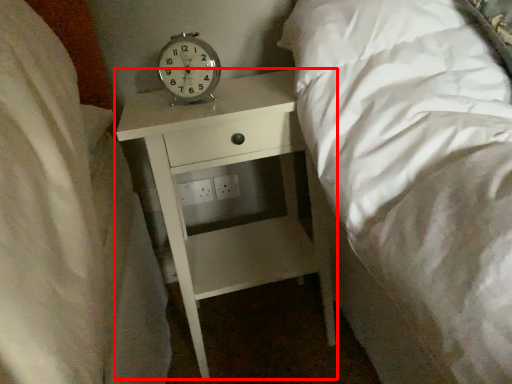
Question: From the image's perspective, considering the relative positions of nightstand (annotated by the red box) and alarm clock in the image provided, where is nightstand (annotated by the red box) located with respect to the staircase?

Choices:
 (A) above
 (B) below

Answer: (B)